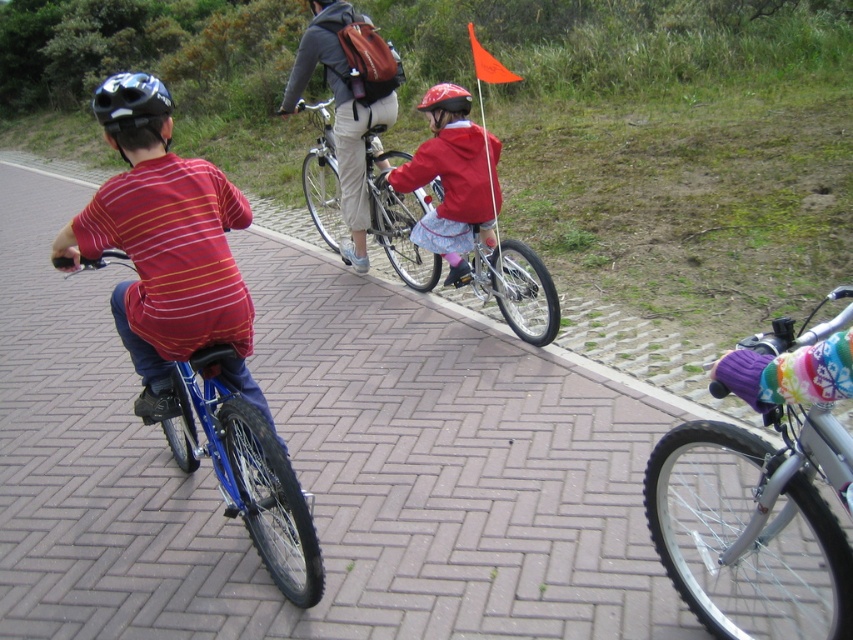
Does matte red jacket at center have a smaller size compared to red matte helmet at center?

Actually, matte red jacket at center might be larger than red matte helmet at center.

Between matte red jacket at center and red matte helmet at center, which one has less height?

Standing shorter between the two is red matte helmet at center.

Identify the location of matte red jacket at center. Image resolution: width=853 pixels, height=640 pixels. (453, 179).

Does matte red jacket at center lie in front of orange fabric flag at upper center?

That is False.

From the picture: Can you confirm if matte red jacket at center is taller than orange fabric flag at upper center?

Incorrect, matte red jacket at center's height is not larger of orange fabric flag at upper center's.

Between point (438, 90) and point (489, 67), which one is positioned behind?

The point (438, 90) is more distant.

You are a GUI agent. You are given a task and a screenshot of the screen. Output one action in this format:
    pyautogui.click(x=<x>, y=<y>)
    Task: Click on the matte red jacket at center
    This screenshot has height=640, width=853.
    Given the screenshot: What is the action you would take?
    pyautogui.click(x=453, y=179)

Locate an element on the screen. The width and height of the screenshot is (853, 640). blue metallic bicycle at left is located at coordinates tap(247, 474).

Which is behind, point (103, 262) or point (363, 118)?

Positioned behind is point (363, 118).

The image size is (853, 640). What do you see at coordinates (247, 474) in the screenshot? I see `blue metallic bicycle at left` at bounding box center [247, 474].

Find the location of a particular element. blue metallic bicycle at left is located at coordinates (247, 474).